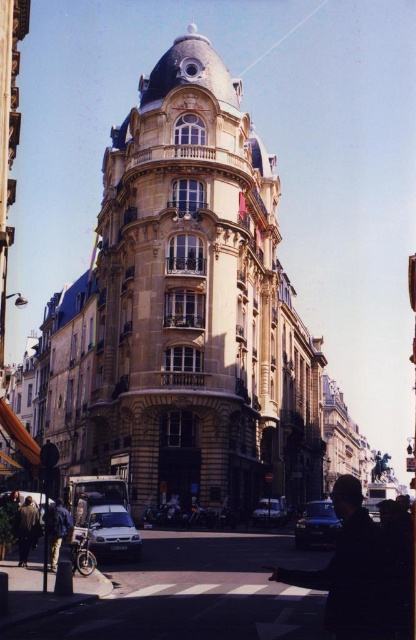
Between dark matte figure at lower right and shiny black car at center, which one has more height?

With more height is dark matte figure at lower right.

Does dark matte figure at lower right appear over shiny black car at center?

Yes, dark matte figure at lower right is above shiny black car at center.

Find the location of `dark matte figure at lower right`. dark matte figure at lower right is located at coordinates (353, 572).

Can you confirm if shiny black car at center is wider than denim jacket at lower left?

No, shiny black car at center is not wider than denim jacket at lower left.

Does shiny black car at center have a lesser height compared to denim jacket at lower left?

No, shiny black car at center is not shorter than denim jacket at lower left.

Does point (319, 513) lie behind point (49, 518)?

Yes.

The height and width of the screenshot is (640, 416). I want to click on shiny black car at center, so click(x=316, y=525).

Which is more to the left, dark matte figure at lower right or silver metallic car at lower left?

silver metallic car at lower left

The width and height of the screenshot is (416, 640). What do you see at coordinates (353, 572) in the screenshot? I see `dark matte figure at lower right` at bounding box center [353, 572].

Identify the location of dark matte figure at lower right. pos(353,572).